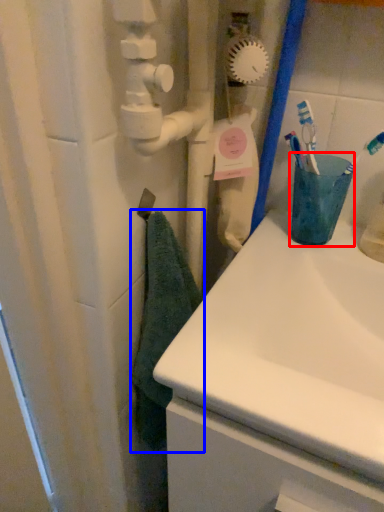
Question: Which point is further to the camera, turquoise (highlighted by a red box) or bath towel (highlighted by a blue box)?

Choices:
 (A) turquoise
 (B) bath towel

Answer: (A)